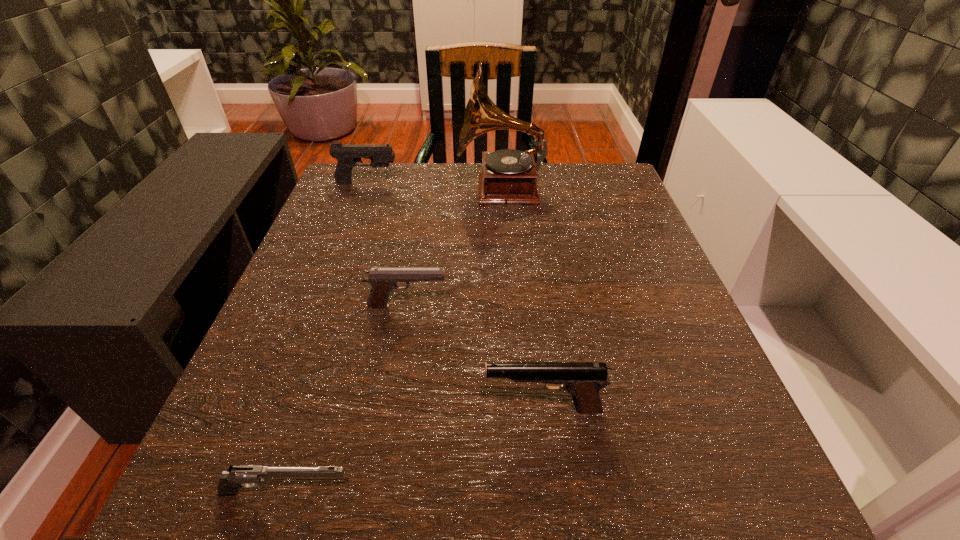
You are a GUI agent. You are given a task and a screenshot of the screen. Output one action in this format:
    pyautogui.click(x=<x>, y=<y>)
    Task: Click on the object at the far left corner
    The height and width of the screenshot is (540, 960).
    Given the screenshot: What is the action you would take?
    pyautogui.click(x=347, y=156)

Find the location of a particular element. This screenshot has width=960, height=540. object that is at the near left corner is located at coordinates (249, 476).

Identify the location of free space at the far edge of the desktop. This screenshot has width=960, height=540. [x=476, y=202].

Identify the location of free spot at the left edge of the desktop. (331, 343).

Locate an element on the screen. vacant area at the right edge is located at coordinates (613, 292).

In the image, there is a desktop. In order to click on blank space at the far left corner in this screenshot , I will do `click(359, 195)`.

At what (x,y) coordinates should I click in order to perform the action: click on vacant space at the far right corner of the desktop. Please return your answer as a coordinate pair (x, y). Looking at the image, I should click on (634, 212).

What are the coordinates of `free space between the phonograph_record and the fourth tallest object` in the screenshot? It's located at click(454, 248).

You are a GUI agent. You are given a task and a screenshot of the screen. Output one action in this format:
    pyautogui.click(x=<x>, y=<y>)
    Task: Click on the vacant space in between the nearest pistol and the tallest object
    
    Given the screenshot: What is the action you would take?
    pyautogui.click(x=394, y=341)

At what (x,y) coordinates should I click in order to perform the action: click on free spot between the farthest pistol and the phonograph_record. Please return your answer as a coordinate pair (x, y). Looking at the image, I should click on (434, 186).